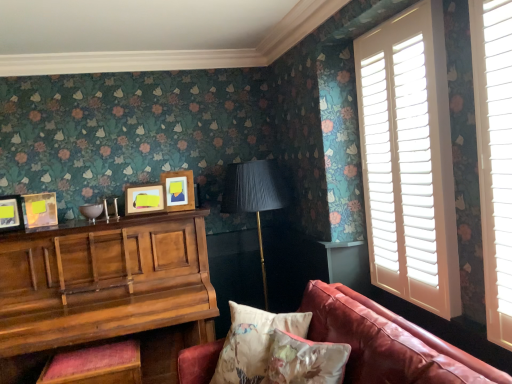
Identify the location of free space in front of matte wooden picture frame at center, which appears as the first picture frame when viewed from the right. Image resolution: width=512 pixels, height=384 pixels. (175, 220).